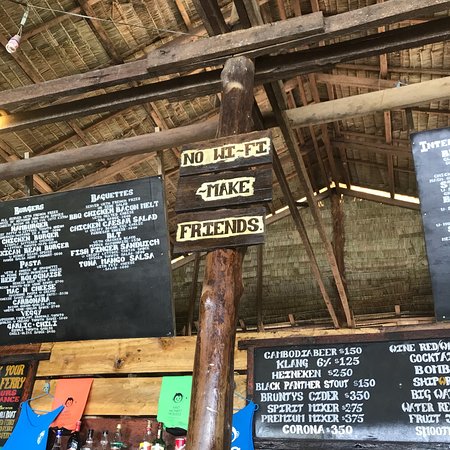
What are the coordinates of `glass bottles` in the screenshot? It's located at (57, 447), (76, 441), (88, 444), (103, 443), (120, 441), (145, 443), (156, 443).